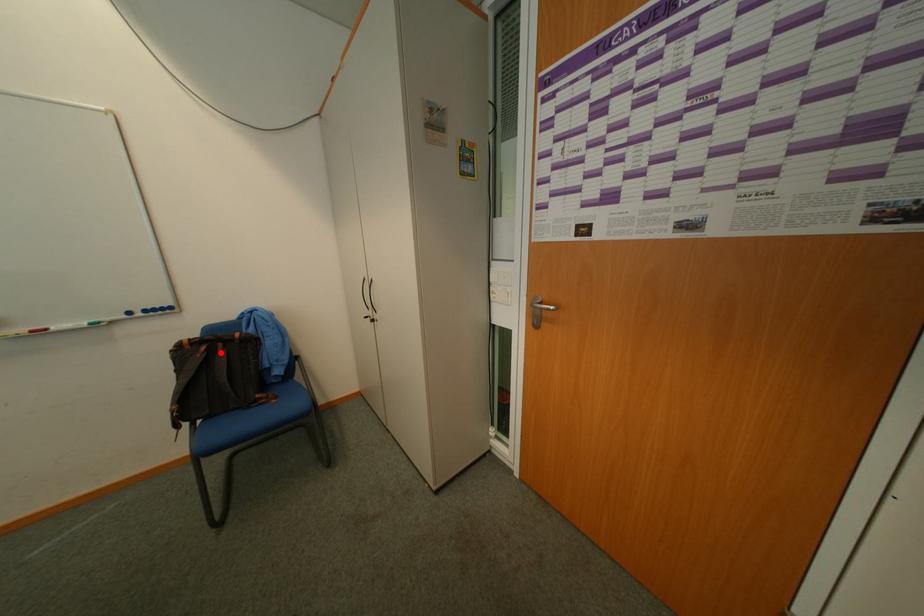
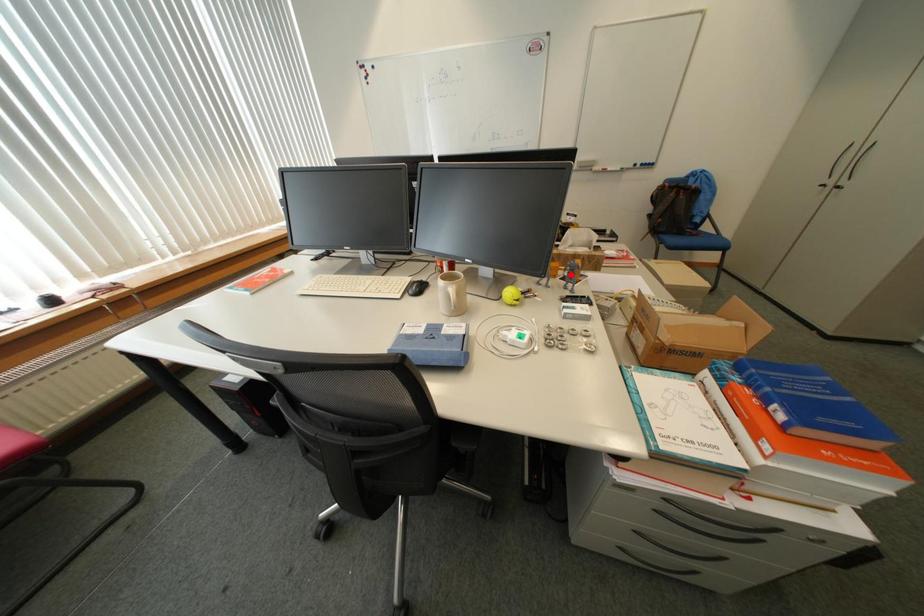
I am providing you with two images of the same scene from different viewpoints. A red point is marked on the first image and another point is marked on the second image. Is the marked point in image1 the same physical position as the marked point in image2?

No